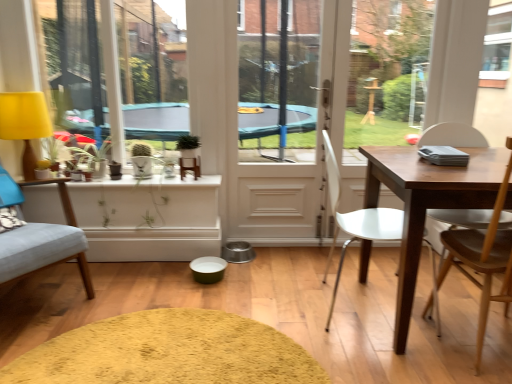
Question: Is yellow fabric lampshade at left facing away from white plastic chair at center, positioned as the second chair in left-to-right order?

Choices:
 (A) no
 (B) yes

Answer: (A)

Question: Is yellow fabric lampshade at left outside white plastic chair at center, positioned as the second chair in left-to-right order?

Choices:
 (A) yes
 (B) no

Answer: (A)

Question: From a real-world perspective, is yellow fabric lampshade at left located beneath white plastic chair at center, the 2th chair when ordered from right to left?

Choices:
 (A) no
 (B) yes

Answer: (A)

Question: Is yellow fabric lampshade at left placed right next to white plastic chair at center, positioned as the second chair in left-to-right order?

Choices:
 (A) no
 (B) yes

Answer: (A)

Question: Is yellow fabric lampshade at left shorter than white plastic chair at center, the 2th chair when ordered from right to left?

Choices:
 (A) no
 (B) yes

Answer: (B)

Question: Is white plastic chair at center, the 2th chair when ordered from right to left, in front of or behind wooden chair at right, arranged as the 3th chair when viewed from the left, in the image?

Choices:
 (A) behind
 (B) front

Answer: (A)

Question: Is white plastic chair at center, the 2th chair when ordered from right to left, inside the boundaries of wooden chair at right, arranged as the 3th chair when viewed from the left, or outside?

Choices:
 (A) outside
 (B) inside

Answer: (A)

Question: In terms of height, does white plastic chair at center, the 2th chair when ordered from right to left, look taller or shorter compared to wooden chair at right, the 1th chair positioned from the right?

Choices:
 (A) tall
 (B) short

Answer: (B)

Question: From a real-world perspective, is white plastic chair at center, positioned as the second chair in left-to-right order, physically located above or below wooden chair at right, the 1th chair positioned from the right?

Choices:
 (A) below
 (B) above

Answer: (A)

Question: Is soft yellow rug at center in front of or behind white plastic chair at center, positioned as the second chair in left-to-right order, in the image?

Choices:
 (A) behind
 (B) front

Answer: (B)

Question: From the image's perspective, is soft yellow rug at center located above or below white plastic chair at center, the 2th chair when ordered from right to left?

Choices:
 (A) above
 (B) below

Answer: (B)

Question: Looking at the image, does soft yellow rug at center seem bigger or smaller compared to white plastic chair at center, positioned as the second chair in left-to-right order?

Choices:
 (A) big
 (B) small

Answer: (B)

Question: Is soft yellow rug at center situated inside white plastic chair at center, the 2th chair when ordered from right to left, or outside?

Choices:
 (A) outside
 (B) inside

Answer: (A)

Question: From a real-world perspective, is soft yellow rug at center above or below yellow fabric lampshade at left?

Choices:
 (A) below
 (B) above

Answer: (A)

Question: In terms of size, does soft yellow rug at center appear bigger or smaller than yellow fabric lampshade at left?

Choices:
 (A) big
 (B) small

Answer: (B)